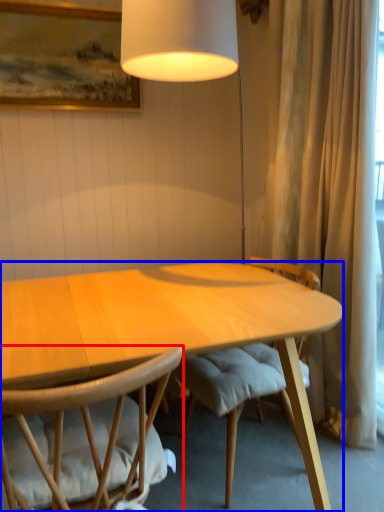
Question: Which of the following is the closest to the observer, chair (highlighted by a red box) or desk (highlighted by a blue box)?

Choices:
 (A) chair
 (B) desk

Answer: (A)